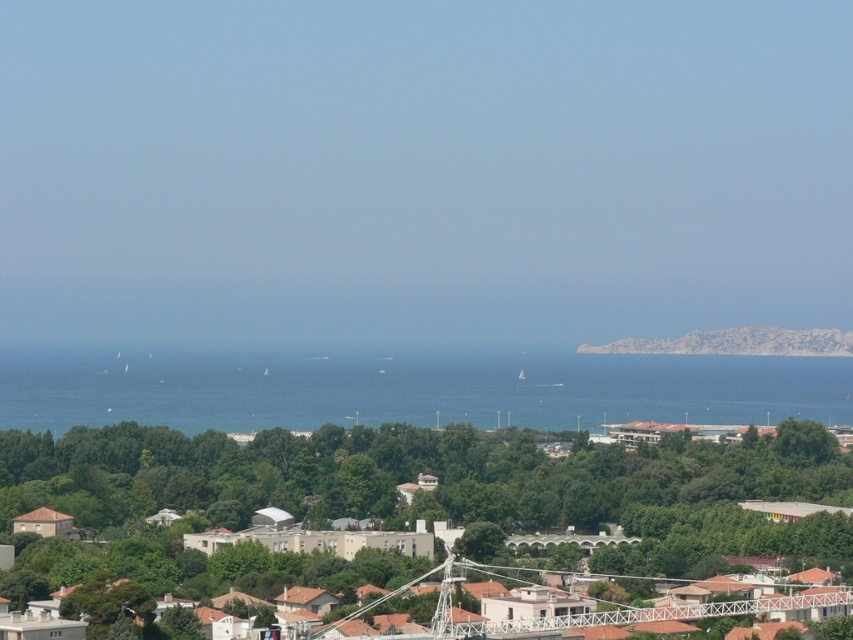
Question: Estimate the real-world distances between objects in this image. Which object is farther from the blue water at center?

Choices:
 (A) green leafy tree at center
 (B) rocky cliff at right

Answer: (B)

Question: Does green leafy tree at center appear under rocky cliff at right?

Choices:
 (A) no
 (B) yes

Answer: (B)

Question: Which of the following is the closest to the observer?

Choices:
 (A) rocky cliff at right
 (B) green leafy tree at center
 (C) blue water at center

Answer: (C)

Question: Can you confirm if green leafy tree at center is smaller than rocky cliff at right?

Choices:
 (A) no
 (B) yes

Answer: (A)

Question: Which object is positioned farthest from the blue water at center?

Choices:
 (A) green leafy tree at center
 (B) rocky cliff at right

Answer: (B)

Question: Is green leafy tree at center positioned before rocky cliff at right?

Choices:
 (A) yes
 (B) no

Answer: (A)